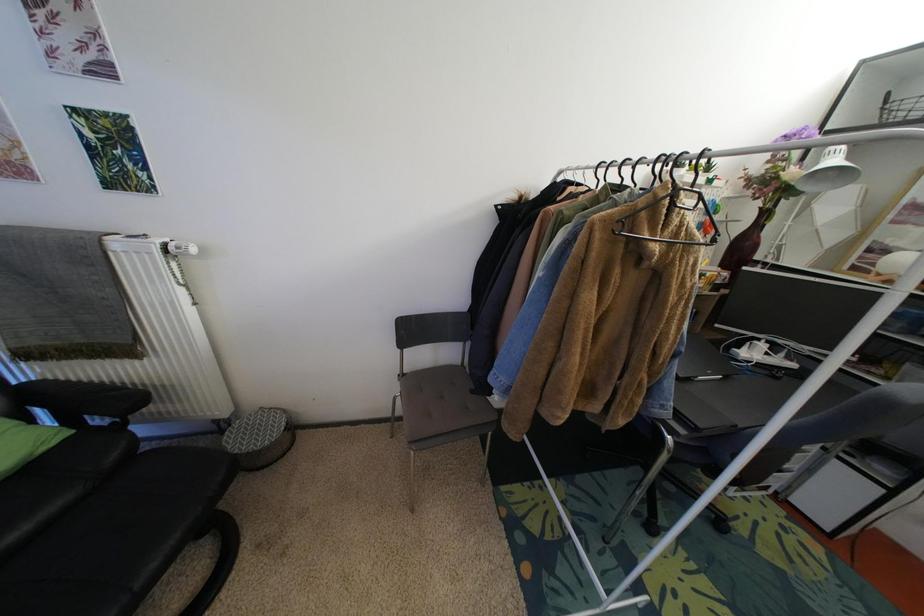
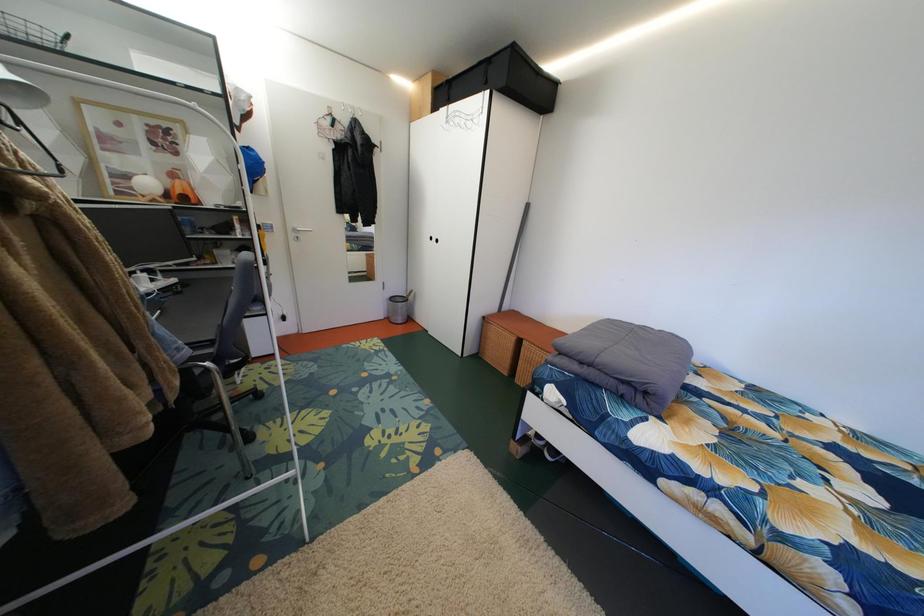
The first image is from the beginning of the video and the second image is from the end. How did the camera likely rotate when shooting the video?

The rotation direction of the camera is right-down.